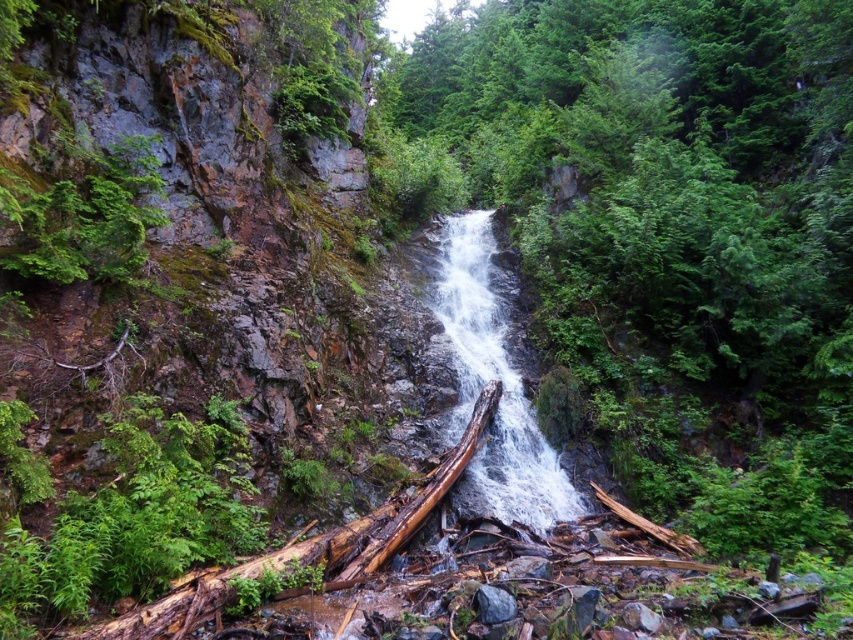
You are standing at the edge of the cliff near the waterfall and want to cross to the other side. There is a green rough log at center. Can you use the log to cross the stream safely?

The green rough log at center is located at point (674, 234), which is the center of the stream. This position suggests the log is positioned in the middle of the stream, making it a stable point to step on while crossing. However, the log is described as rough, which might provide better traction. Therefore, it should be safe to use the green rough log at center to cross the stream.

You are standing at the edge of the stream in the scene and notice a point marked at coordinates (674, 234). Based on the description, can you identify what object this point is located on?

The point at (674, 234) is located on the green rough log at center.

You are a hiker who has just arrived at the waterfall. You notice a green rough log at center and white frothy water at center. If you want to cross the stream safely, which object should you aim for as a crossing point and why?

You should aim for the green rough log at center because it is 6.31 meters away from the white frothy water at center, which indicates it is a stable and safer crossing point farther from the turbulent water.